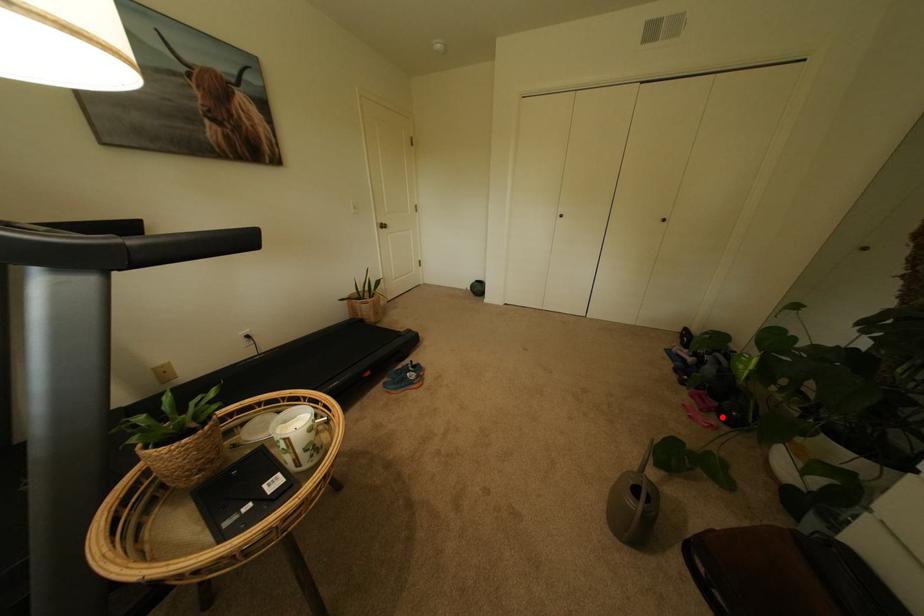
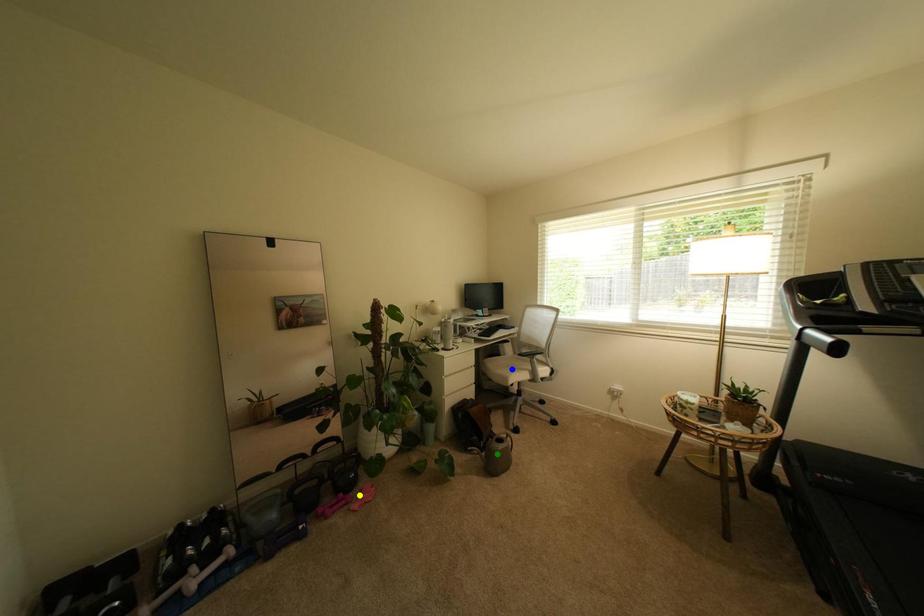
Question: I am providing you with two images of the same scene from different viewpoints. A red point is marked on the first image. You are given multiple points on the second image. Can you choose the point in image 2 that corresponds to the point in image 1?

Choices:
 (A) green point
 (B) yellow point
 (C) blue point

Answer: (B)